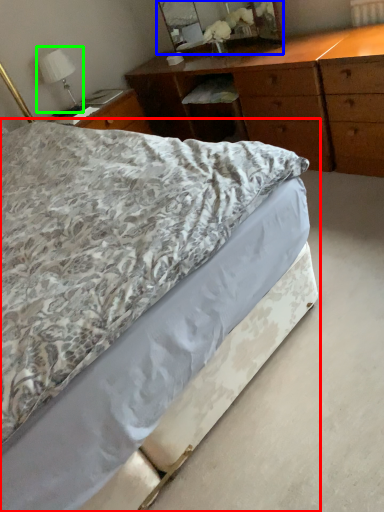
Question: Which is farther away from bed (highlighted by a red box)? mirror (highlighted by a blue box) or bedside lamp (highlighted by a green box)?

Choices:
 (A) mirror
 (B) bedside lamp

Answer: (A)